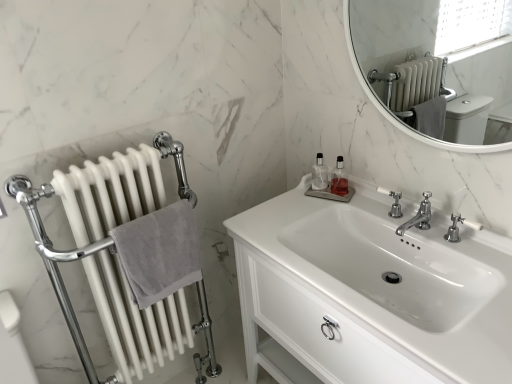
Locate an element on the screen. gray cotton towel at left is located at coordinates (159, 252).

The width and height of the screenshot is (512, 384). In order to click on white glossy sink at center in this screenshot , I will do `click(370, 293)`.

What do you see at coordinates (118, 189) in the screenshot? I see `white matte radiator at left` at bounding box center [118, 189].

At what (x,y) coordinates should I click in order to perform the action: click on polished chrome faucet at center, the 2th tap when ordered from right to left. Please return your answer as a coordinate pair (x, y). Image resolution: width=512 pixels, height=384 pixels. Looking at the image, I should click on (418, 216).

Is white glossy sink at center in front of or behind polished chrome faucet at center, the 2th tap when ordered from right to left, in the image?

white glossy sink at center is in front of polished chrome faucet at center, the 2th tap when ordered from right to left.

From the image's perspective, is white glossy sink at center beneath polished chrome faucet at center, which ranks as the 1th tap in left-to-right order?

Yes, from the image's perspective, white glossy sink at center is below polished chrome faucet at center, which ranks as the 1th tap in left-to-right order.

Considering the relative sizes of white glossy sink at center and polished chrome faucet at center, the 2th tap when ordered from right to left, in the image provided, is white glossy sink at center thinner than polished chrome faucet at center, the 2th tap when ordered from right to left,?

No, white glossy sink at center is not thinner than polished chrome faucet at center, the 2th tap when ordered from right to left.

Measure the distance from clear glass bottle at upper center, arranged as the 2th toiletry when viewed from the right, to polished chrome faucet at right, acting as the first tap starting from the right.

They are 20.55 inches apart.

Is clear glass bottle at upper center, arranged as the 2th toiletry when viewed from the right, in front of or behind polished chrome faucet at right, the second tap when ordered from left to right, in the image?

clear glass bottle at upper center, arranged as the 2th toiletry when viewed from the right, is positioned farther from the viewer than polished chrome faucet at right, the second tap when ordered from left to right.

Is the surface of clear glass bottle at upper center, marked as the first toiletry in a left-to-right arrangement, in direct contact with polished chrome faucet at right, the second tap when ordered from left to right?

No, clear glass bottle at upper center, marked as the first toiletry in a left-to-right arrangement, is not next to polished chrome faucet at right, the second tap when ordered from left to right.

Who is taller, clear glass bottle at upper center, arranged as the 2th toiletry when viewed from the right, or polished chrome faucet at right, the second tap when ordered from left to right?

Standing taller between the two is clear glass bottle at upper center, arranged as the 2th toiletry when viewed from the right.

Is polished chrome faucet at center, which ranks as the 1th tap in left-to-right order, situated inside clear glass bottle at upper center, which is counted as the second toiletry, starting from the left, or outside?

polished chrome faucet at center, which ranks as the 1th tap in left-to-right order, is outside clear glass bottle at upper center, which is counted as the second toiletry, starting from the left.

In terms of height, does polished chrome faucet at center, the 2th tap when ordered from right to left, look taller or shorter compared to clear glass bottle at upper center, the first toiletry when ordered from right to left?

Considering their sizes, polished chrome faucet at center, the 2th tap when ordered from right to left, has less height than clear glass bottle at upper center, the first toiletry when ordered from right to left.

Does polished chrome faucet at center, which ranks as the 1th tap in left-to-right order, lie behind clear glass bottle at upper center, the first toiletry when ordered from right to left?

No.

Is there a large distance between polished chrome faucet at center, the 2th tap when ordered from right to left, and clear glass bottle at upper center, which is counted as the second toiletry, starting from the left?

No, polished chrome faucet at center, the 2th tap when ordered from right to left, is not far away from clear glass bottle at upper center, which is counted as the second toiletry, starting from the left.

Which of these two, clear glass bottle at upper center, which is counted as the second toiletry, starting from the left, or gray cotton towel at left, is wider?

Wider between the two is gray cotton towel at left.

Which is closer to the camera, (342, 183) or (184, 275)?

Point (342, 183).

Can you tell me how much clear glass bottle at upper center, which is counted as the second toiletry, starting from the left, and gray cotton towel at left differ in facing direction?

The angle between the facing direction of clear glass bottle at upper center, which is counted as the second toiletry, starting from the left, and the facing direction of gray cotton towel at left is 66.8 degrees.

Who is more distant, clear glass bottle at upper center, which is counted as the second toiletry, starting from the left, or gray cotton towel at left?

Positioned behind is clear glass bottle at upper center, which is counted as the second toiletry, starting from the left.

Is clear glass bottle at upper center, which is counted as the second toiletry, starting from the left, looking in the opposite direction of clear glass bottle at upper center, arranged as the 2th toiletry when viewed from the right?

clear glass bottle at upper center, which is counted as the second toiletry, starting from the left, does not have its back to clear glass bottle at upper center, arranged as the 2th toiletry when viewed from the right.

Is clear glass bottle at upper center, the first toiletry when ordered from right to left, smaller than clear glass bottle at upper center, arranged as the 2th toiletry when viewed from the right?

Correct, clear glass bottle at upper center, the first toiletry when ordered from right to left, occupies less space than clear glass bottle at upper center, arranged as the 2th toiletry when viewed from the right.

From a real-world perspective, which object rests below the other?

clear glass bottle at upper center, the first toiletry when ordered from right to left, is physically lower.

Which point is more distant from viewer, (333,182) or (325,167)?

The point (325,167) is more distant.

Which is in front, white matte radiator at left or polished chrome faucet at center, which ranks as the 1th tap in left-to-right order?

white matte radiator at left.

From a real-world perspective, does white matte radiator at left sit lower than polished chrome faucet at center, which ranks as the 1th tap in left-to-right order?

Indeed, from a real-world perspective, white matte radiator at left is positioned beneath polished chrome faucet at center, which ranks as the 1th tap in left-to-right order.

This screenshot has height=384, width=512. What are the coordinates of `radiator below the polished chrome faucet at center, which ranks as the 1th tap in left-to-right order (from the image's perspective)` in the screenshot? It's located at (118, 189).

How much distance is there between white matte radiator at left and polished chrome faucet at center, which ranks as the 1th tap in left-to-right order?

white matte radiator at left is 94.77 centimeters from polished chrome faucet at center, which ranks as the 1th tap in left-to-right order.

From a real-world perspective, which is physically above, polished chrome faucet at right, acting as the first tap starting from the right, or polished chrome faucet at upper right?

polished chrome faucet at right, acting as the first tap starting from the right, is physically above.

From the image's perspective, would you say polished chrome faucet at right, the second tap when ordered from left to right, is shown under polished chrome faucet at upper right?

Correct, polished chrome faucet at right, the second tap when ordered from left to right, appears lower than polished chrome faucet at upper right in the image.

Could you tell me if polished chrome faucet at right, the second tap when ordered from left to right, is turned towards polished chrome faucet at upper right?

No, polished chrome faucet at right, the second tap when ordered from left to right, is not turned towards polished chrome faucet at upper right.

Considering the positions of points (461, 217) and (397, 209), is point (461, 217) farther from camera compared to point (397, 209)?

No, it is in front of (397, 209).

Where is `sink below the polished chrome faucet at center, which ranks as the 1th tap in left-to-right order (from a real-world perspective)`? sink below the polished chrome faucet at center, which ranks as the 1th tap in left-to-right order (from a real-world perspective) is located at coordinates (370, 293).

Find the location of a particular element. This screenshot has height=384, width=512. the 2nd toiletry directly above the polished chrome faucet at right, acting as the first tap starting from the right (from a real-world perspective) is located at coordinates (319, 174).

Which object lies further to the anchor point polished chrome faucet at center, the 2th tap when ordered from right to left, clear glass bottle at upper center, which is counted as the second toiletry, starting from the left, or gray cotton towel at left?

Among the two, gray cotton towel at left is located further to polished chrome faucet at center, the 2th tap when ordered from right to left.

Considering their positions, is white glossy sink at center positioned closer to polished chrome faucet at upper right than white matte radiator at left?

Based on the image, white glossy sink at center appears to be nearer to polished chrome faucet at upper right.

Looking at the image, which one is located closer to clear glass bottle at upper center, the first toiletry when ordered from right to left, white matte radiator at left or polished chrome faucet at upper right?

polished chrome faucet at upper right.

Estimate the real-world distances between objects in this image. Which object is closer to gray cotton towel at left, white glossy sink at center or white matte radiator at left?

Based on the image, white matte radiator at left appears to be nearer to gray cotton towel at left.

Looking at the image, which one is located further to white glossy sink at center, polished chrome faucet at center, which ranks as the 1th tap in left-to-right order, or clear glass bottle at upper center, which is counted as the second toiletry, starting from the left?

clear glass bottle at upper center, which is counted as the second toiletry, starting from the left.

Estimate the real-world distances between objects in this image. Which object is further from clear glass bottle at upper center, marked as the first toiletry in a left-to-right arrangement, polished chrome faucet at upper right or polished chrome faucet at center, which ranks as the 1th tap in left-to-right order?

polished chrome faucet at center, which ranks as the 1th tap in left-to-right order, lies further to clear glass bottle at upper center, marked as the first toiletry in a left-to-right arrangement, than the other object.

Considering their positions, is white glossy sink at center positioned further to polished chrome faucet at right, acting as the first tap starting from the right, than polished chrome faucet at upper right?

Based on the image, white glossy sink at center appears to be further to polished chrome faucet at right, acting as the first tap starting from the right.

Estimate the real-world distances between objects in this image. Which object is closer to clear glass bottle at upper center, marked as the first toiletry in a left-to-right arrangement, white glossy sink at center or white marble mirror at upper right?

white glossy sink at center.

Locate an element on the screen. toiletry between white marble mirror at upper right and clear glass bottle at upper center, arranged as the 2th toiletry when viewed from the right, along the z-axis is located at coordinates click(339, 179).

Find the location of `plumbing fixture between white marble mirror at upper right and clear glass bottle at upper center, marked as the first toiletry in a left-to-right arrangement, from front to back`. plumbing fixture between white marble mirror at upper right and clear glass bottle at upper center, marked as the first toiletry in a left-to-right arrangement, from front to back is located at coordinates (393, 203).

At what (x,y) coordinates should I click in order to perform the action: click on mirror located between white matte radiator at left and polished chrome faucet at right, the second tap when ordered from left to right, in the left-right direction. Please return your answer as a coordinate pair (x, y). Looking at the image, I should click on (437, 66).

Locate an element on the screen. The height and width of the screenshot is (384, 512). sink between gray cotton towel at left and polished chrome faucet at upper right from left to right is located at coordinates (370, 293).